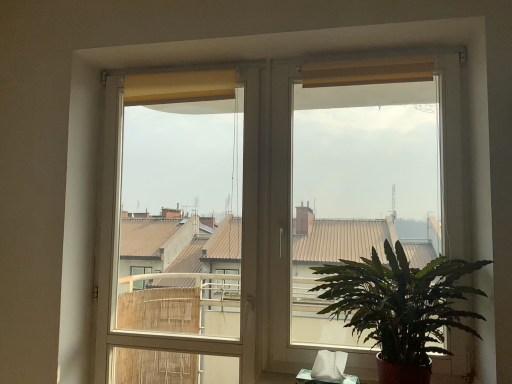
Question: Is green leafy plant at lower right oriented away from white plastic window frame at center?

Choices:
 (A) no
 (B) yes

Answer: (A)

Question: From the image's perspective, is green leafy plant at lower right over white plastic window frame at center?

Choices:
 (A) yes
 (B) no

Answer: (B)

Question: Is the depth of green leafy plant at lower right greater than that of white plastic window frame at center?

Choices:
 (A) no
 (B) yes

Answer: (A)

Question: Does green leafy plant at lower right have a lesser height compared to white plastic window frame at center?

Choices:
 (A) yes
 (B) no

Answer: (A)

Question: Considering the relative positions of green leafy plant at lower right and white plastic window frame at center in the image provided, is green leafy plant at lower right to the left of white plastic window frame at center from the viewer's perspective?

Choices:
 (A) no
 (B) yes

Answer: (A)

Question: Could you tell me if green leafy plant at lower right is turned towards white plastic window frame at center?

Choices:
 (A) no
 (B) yes

Answer: (A)

Question: Considering the relative positions of white plastic window frame at center and matte yellow screen at right in the image provided, is white plastic window frame at center to the right of matte yellow screen at right from the viewer's perspective?

Choices:
 (A) yes
 (B) no

Answer: (B)

Question: Are white plastic window frame at center and matte yellow screen at right located far from each other?

Choices:
 (A) no
 (B) yes

Answer: (B)

Question: Can you confirm if white plastic window frame at center is thinner than matte yellow screen at right?

Choices:
 (A) yes
 (B) no

Answer: (B)

Question: From the image's perspective, is white plastic window frame at center over matte yellow screen at right?

Choices:
 (A) yes
 (B) no

Answer: (B)

Question: Is white plastic window frame at center placed right next to matte yellow screen at right?

Choices:
 (A) yes
 (B) no

Answer: (B)

Question: Is white plastic window frame at center turned away from matte yellow screen at right?

Choices:
 (A) yes
 (B) no

Answer: (B)

Question: Considering the relative sizes of matte yellow screen at right and green leafy plant at lower right in the image provided, is matte yellow screen at right shorter than green leafy plant at lower right?

Choices:
 (A) no
 (B) yes

Answer: (A)